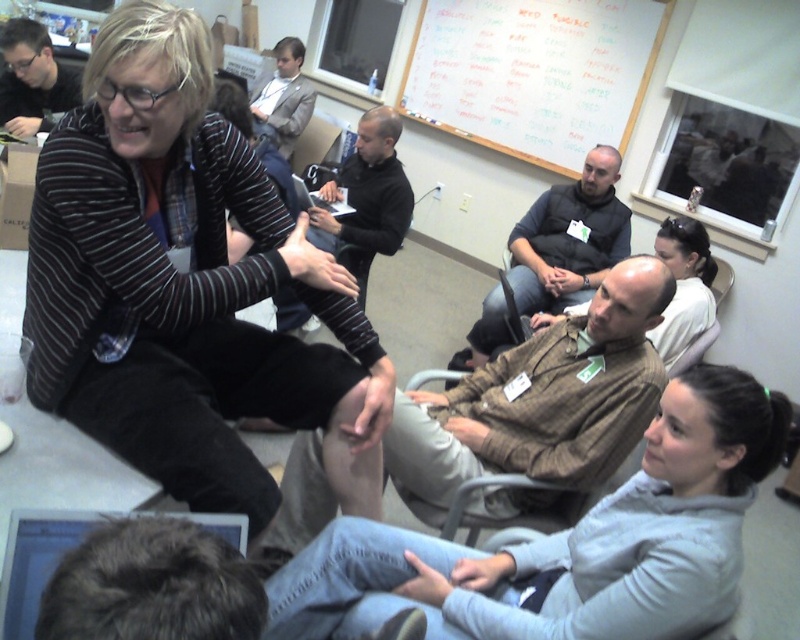
Which of these two, light gray fleece at lower right or black smooth shirt at center, stands shorter?

Standing shorter between the two is light gray fleece at lower right.

Does light gray fleece at lower right appear over black smooth shirt at center?

No.

Where is `light gray fleece at lower right`? The height and width of the screenshot is (640, 800). light gray fleece at lower right is located at coordinates (570, 544).

Is dark brown leather jacket at center behind matte black sweater at upper left?

No.

Describe the element at coordinates (570, 237) in the screenshot. This screenshot has height=640, width=800. I see `dark brown leather jacket at center` at that location.

Where is `dark brown leather jacket at center`? The width and height of the screenshot is (800, 640). dark brown leather jacket at center is located at coordinates (570, 237).

Who is positioned more to the right, silver metallic laptop at lower left or matte black laptop at upper left?

Positioned to the right is silver metallic laptop at lower left.

Where is `silver metallic laptop at lower left`? This screenshot has height=640, width=800. silver metallic laptop at lower left is located at coordinates (66, 552).

Does point (222, 531) come farther from viewer compared to point (28, 125)?

No, it is not.

Find the location of a particular element. This screenshot has height=640, width=800. silver metallic laptop at lower left is located at coordinates (66, 552).